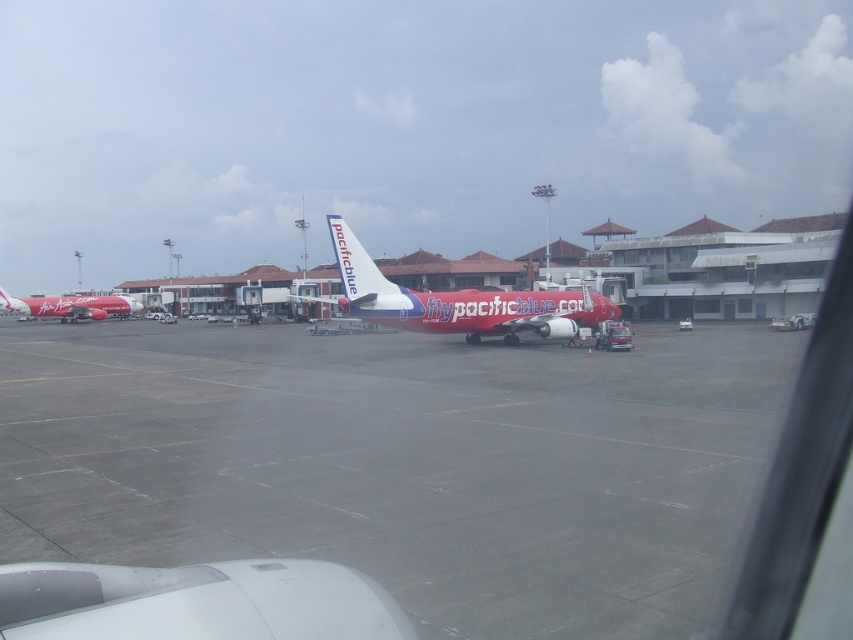
Question: Does gray asphalt runway at center appear under matte red airplane at center?

Choices:
 (A) yes
 (B) no

Answer: (A)

Question: Estimate the real-world distances between objects in this image. Which object is closer to the gray asphalt runway at center?

Choices:
 (A) matte red airplane at center
 (B) matte red airplane at left

Answer: (A)

Question: Does matte red airplane at center appear on the left side of matte red airplane at left?

Choices:
 (A) yes
 (B) no

Answer: (B)

Question: Which object is closer to the camera taking this photo?

Choices:
 (A) matte red airplane at center
 (B) gray asphalt runway at center
 (C) matte red airplane at left

Answer: (B)

Question: Is gray asphalt runway at center thinner than matte red airplane at center?

Choices:
 (A) no
 (B) yes

Answer: (A)

Question: Which point is farther to the camera?

Choices:
 (A) matte red airplane at center
 (B) matte red airplane at left

Answer: (B)